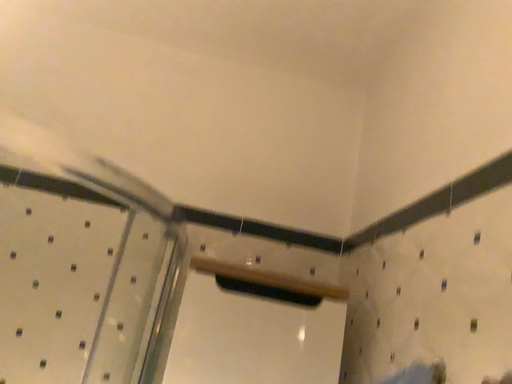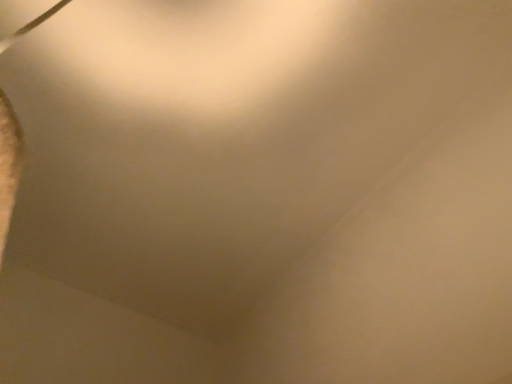
Question: Which way did the camera rotate in the video?

Choices:
 (A) rotated upward
 (B) rotated downward

Answer: (A)